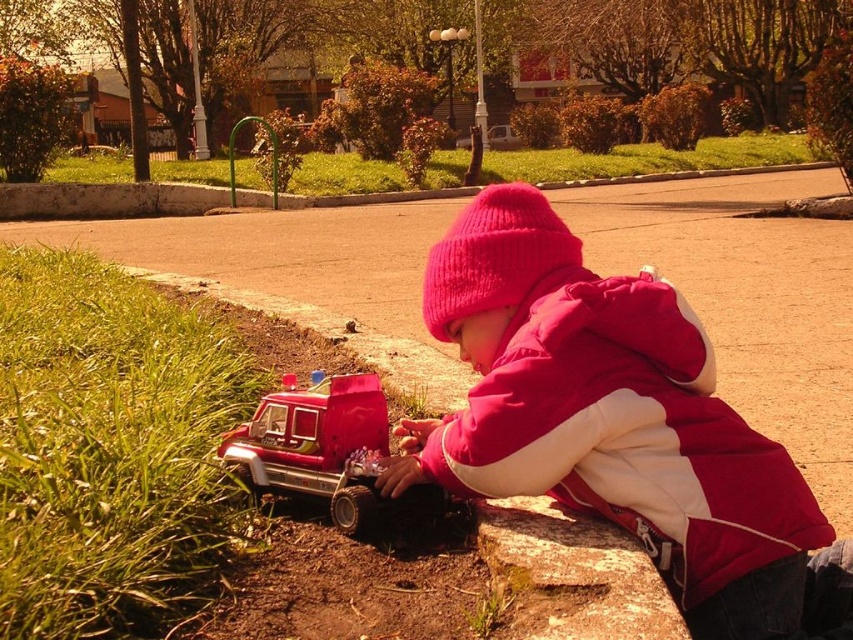
Question: Among these objects, which one is farthest from the camera?

Choices:
 (A) pink knit hat at upper center
 (B) metallic silver car at center
 (C) shiny red plastic fire truck at lower left

Answer: (B)

Question: Does pink knit hat at upper center have a smaller size compared to shiny red plastic fire truck at lower left?

Choices:
 (A) no
 (B) yes

Answer: (A)

Question: Based on their relative distances, which object is nearer to the pink knit hat at upper center?

Choices:
 (A) metallic silver car at center
 (B) shiny red plastic fire truck at lower left

Answer: (B)

Question: Can you confirm if shiny red plastic fire truck at lower left is positioned to the right of metallic silver car at center?

Choices:
 (A) yes
 (B) no

Answer: (B)

Question: Estimate the real-world distances between objects in this image. Which object is closer to the pink knit hat at upper center?

Choices:
 (A) metallic silver car at center
 (B) shiny red plastic fire truck at lower left

Answer: (B)

Question: Is pink knit hat at upper center bigger than metallic silver car at center?

Choices:
 (A) no
 (B) yes

Answer: (A)